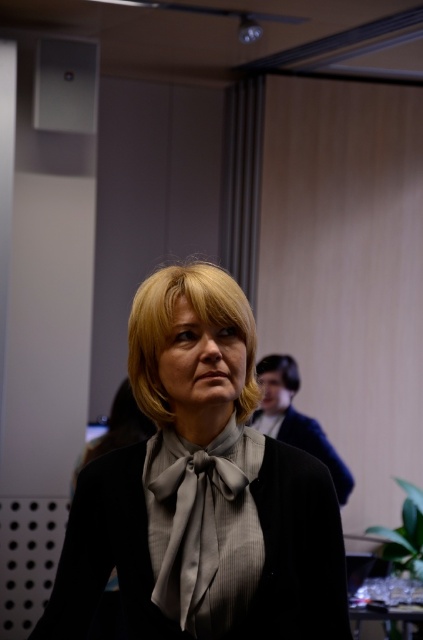
Question: Which object is positioned closest to the blonde hair at upper right?

Choices:
 (A) black satin business suit at center
 (B) matte gray blouse at center

Answer: (A)

Question: Among these objects, which one is farthest from the camera?

Choices:
 (A) gray satin tie at center
 (B) matte gray blouse at center
 (C) blonde hair at upper right
 (D) blonde silky hair at center

Answer: (C)

Question: Is the position of matte gray blouse at center less distant than that of gray satin tie at center?

Choices:
 (A) yes
 (B) no

Answer: (A)

Question: Does black satin business suit at center appear over blonde hair at upper right?

Choices:
 (A) no
 (B) yes

Answer: (A)

Question: Is black satin business suit at center smaller than blonde hair at upper right?

Choices:
 (A) yes
 (B) no

Answer: (B)

Question: Which of the following is the closest to the observer?

Choices:
 (A) (296, 376)
 (B) (342, 552)
 (C) (318, 433)
 (D) (246, 324)

Answer: (B)